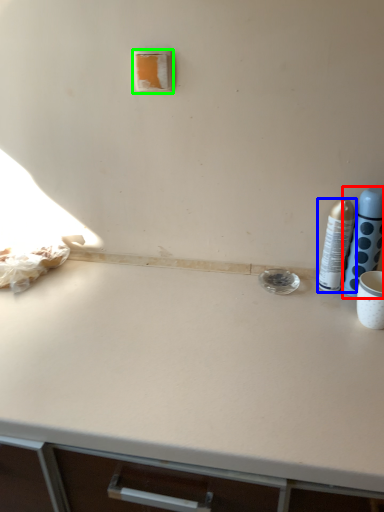
Question: Which is farther away from bottle (highlighted by a red box)? bottle (highlighted by a blue box) or light switch (highlighted by a green box)?

Choices:
 (A) bottle
 (B) light switch

Answer: (B)